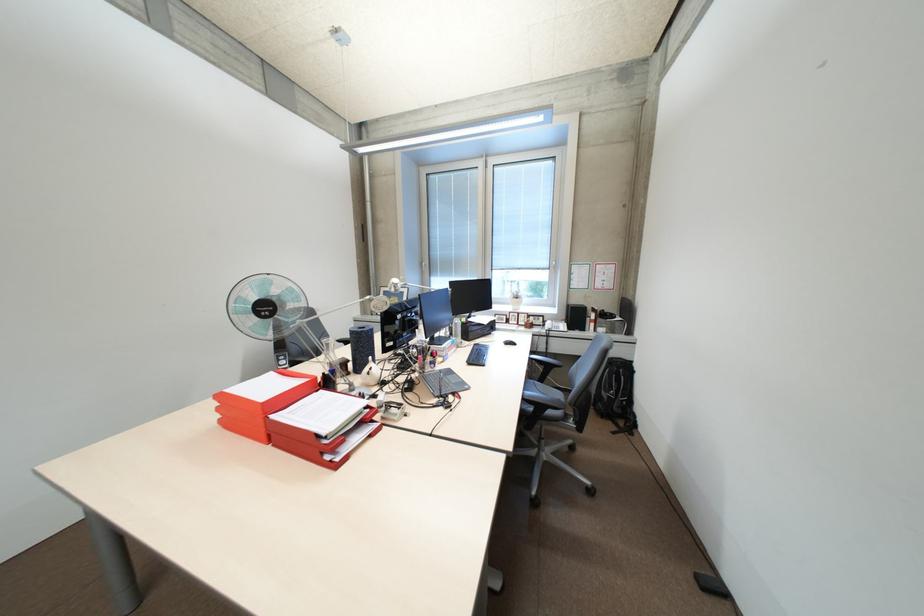
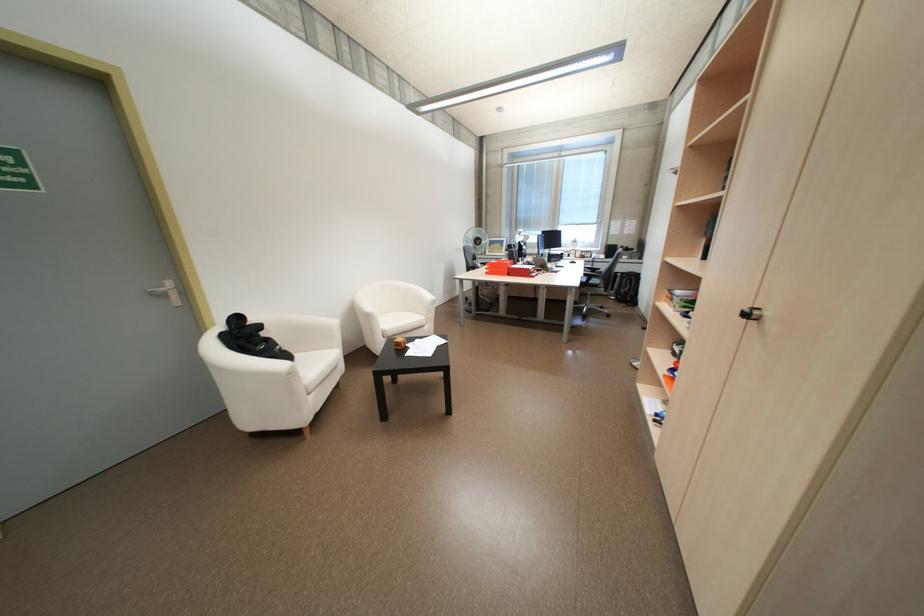
In a continuous first-person perspective shot, in which direction is the camera moving?

The cameraman walked toward left, backward.